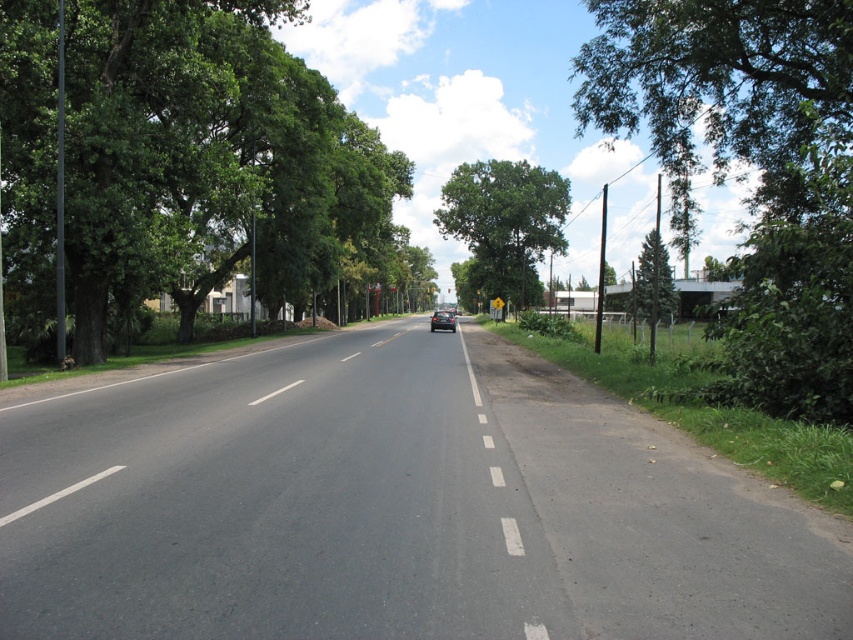
You are a driver planning to park your car on the side of the road. You notice the green leafy tree at left and the white asphalt road at center. Which one has a greater width?

The green leafy tree at left has a greater width than the white asphalt road at center according to the description.

Based on the photo, you are driving a car and need to stay within the road boundaries. Considering the green leafy tree at center and the white asphalt road at center, which one should you avoid hitting?

You should avoid hitting the white asphalt road at center because it is smaller than the green leafy tree at center, so staying on the road ensures safety.